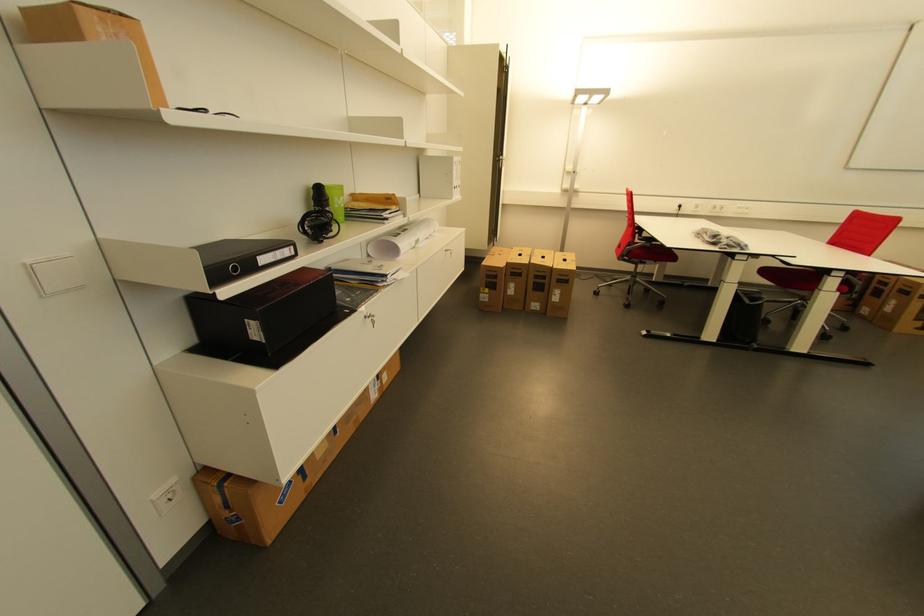
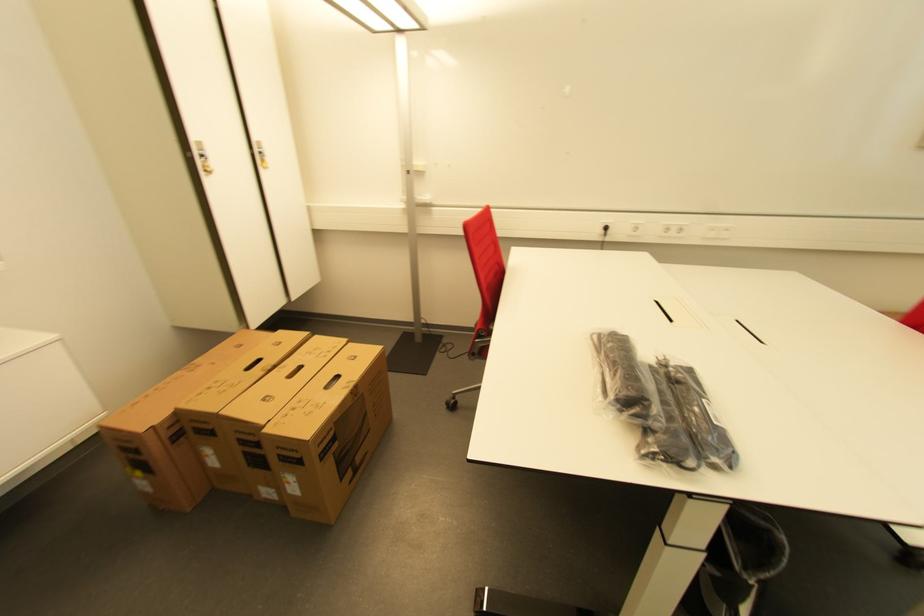
Question: I am providing you with two images of the same scene from different viewpoints. Please identify which objects are invisible in image2.

Choices:
 (A) white power outlet
 (B) open drawer front
 (C) cardboard box handle
 (D) red chair sitting surface

Answer: (D)